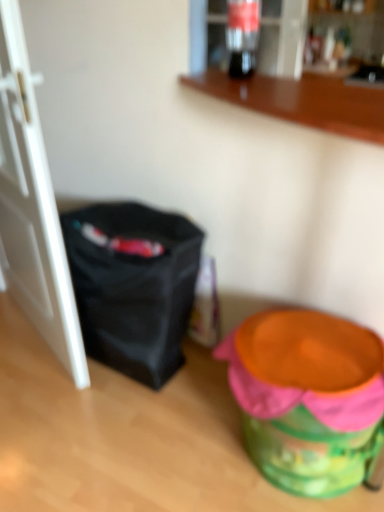
Question: From the image's perspective, is translucent glass soda at upper center on top of wooden counter at upper center?

Choices:
 (A) no
 (B) yes

Answer: (B)

Question: Is translucent glass soda at upper center taller than wooden counter at upper center?

Choices:
 (A) no
 (B) yes

Answer: (B)

Question: Does translucent glass soda at upper center have a greater width compared to wooden counter at upper center?

Choices:
 (A) no
 (B) yes

Answer: (A)

Question: Is translucent glass soda at upper center surrounding wooden counter at upper center?

Choices:
 (A) yes
 (B) no

Answer: (B)

Question: Considering the relative sizes of translucent glass soda at upper center and wooden counter at upper center in the image provided, is translucent glass soda at upper center smaller than wooden counter at upper center?

Choices:
 (A) no
 (B) yes

Answer: (B)

Question: In the image, is wooden counter at upper center positioned in front of or behind black fabric bag at left?

Choices:
 (A) front
 (B) behind

Answer: (A)

Question: Is wooden counter at upper center bigger or smaller than black fabric bag at left?

Choices:
 (A) big
 (B) small

Answer: (B)

Question: Is wooden counter at upper center inside the boundaries of black fabric bag at left, or outside?

Choices:
 (A) outside
 (B) inside

Answer: (A)

Question: Is point pyautogui.click(x=304, y=89) positioned closer to the camera than point pyautogui.click(x=127, y=226)?

Choices:
 (A) farther
 (B) closer

Answer: (B)

Question: Considering the positions of wooden counter at upper center and white matte door at left in the image, is wooden counter at upper center wider or thinner than white matte door at left?

Choices:
 (A) thin
 (B) wide

Answer: (B)

Question: Considering the positions of wooden counter at upper center and white matte door at left in the image, is wooden counter at upper center taller or shorter than white matte door at left?

Choices:
 (A) tall
 (B) short

Answer: (B)

Question: Considering the positions of point (352, 136) and point (26, 62), is point (352, 136) closer or farther from the camera than point (26, 62)?

Choices:
 (A) farther
 (B) closer

Answer: (B)

Question: From a real-world perspective, is wooden counter at upper center above or below white matte door at left?

Choices:
 (A) above
 (B) below

Answer: (A)

Question: Do you think translucent glass soda at upper center is within wooden counter at upper center, or outside of it?

Choices:
 (A) inside
 (B) outside

Answer: (B)

Question: From a real-world perspective, is translucent glass soda at upper center positioned above or below wooden counter at upper center?

Choices:
 (A) above
 (B) below

Answer: (A)